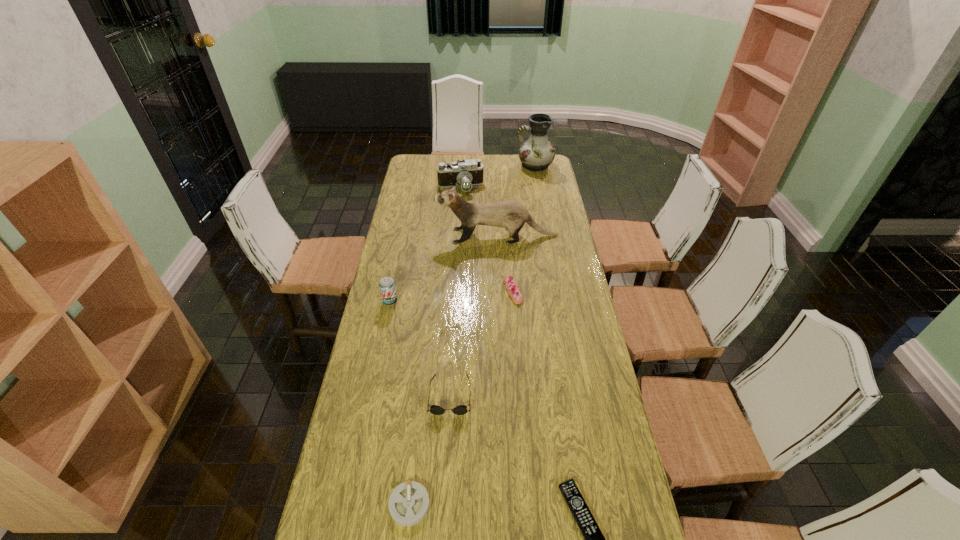
At what (x,y) coordinates should I click in order to perform the action: click on vase. Please return your answer as a coordinate pair (x, y). Image resolution: width=960 pixels, height=540 pixels. Looking at the image, I should click on (537, 153).

Where is `the seventh shortest object`? the seventh shortest object is located at coordinates (510, 214).

Where is `ferret`? ferret is located at coordinates (510, 214).

The height and width of the screenshot is (540, 960). I want to click on the seventh nearest object, so click(x=466, y=173).

Where is `beer can`? The image size is (960, 540). beer can is located at coordinates (387, 287).

Where is `the leftmost object`? Image resolution: width=960 pixels, height=540 pixels. the leftmost object is located at coordinates (387, 287).

The width and height of the screenshot is (960, 540). Identify the location of sunglasses. pyautogui.click(x=434, y=409).

Find the location of a particular element. Image resolution: width=960 pixels, height=540 pixels. the fifth tallest object is located at coordinates (434, 409).

Locate an element on the screen. This screenshot has width=960, height=540. the sixth tallest object is located at coordinates (513, 290).

This screenshot has height=540, width=960. What are the coordinates of `ashtray` in the screenshot? It's located at (408, 504).